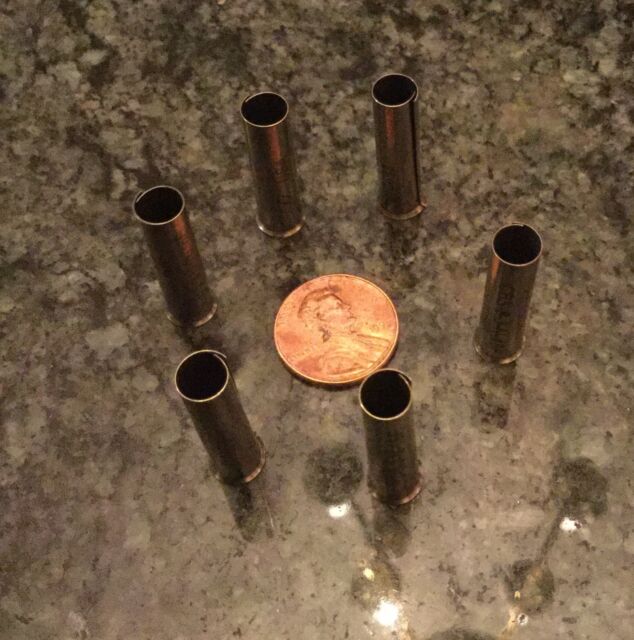
Locate an element on the screen. This screenshot has height=640, width=634. shiny grayish/brownish counter top is located at coordinates (494, 457).